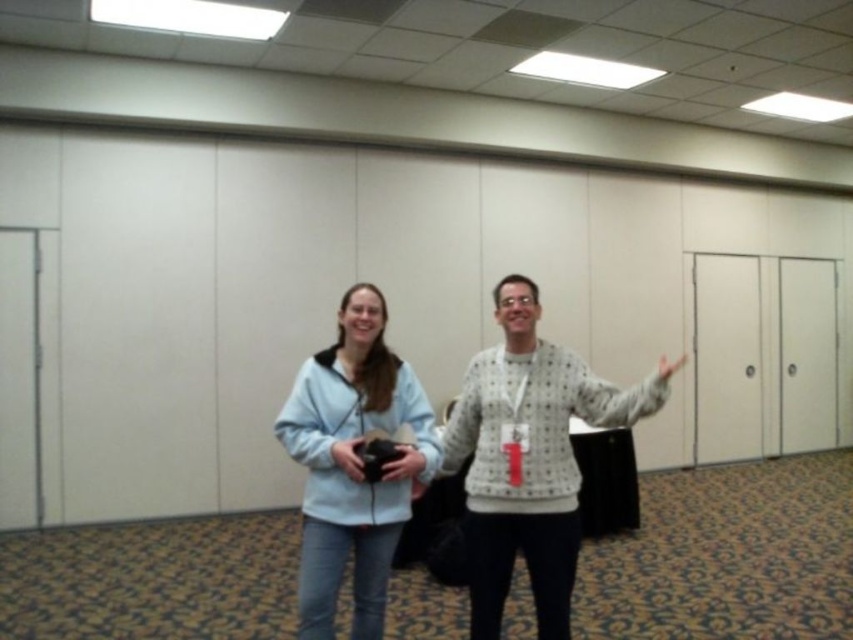
In the conference room scene, there are two people wearing the light blue fleece at center and the matte gray sweater at center. Which one is positioned to the left?

The light blue fleece at center is positioned to the left of the matte gray sweater at center.